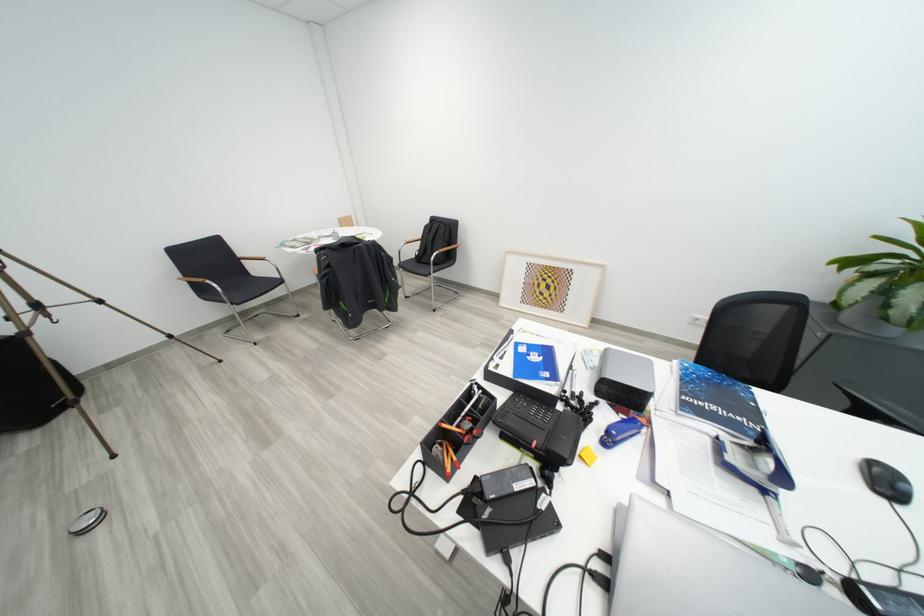
The image size is (924, 616). Describe the element at coordinates (619, 431) in the screenshot. I see `a blue stapler` at that location.